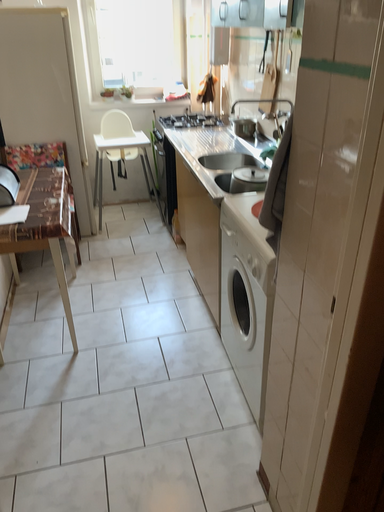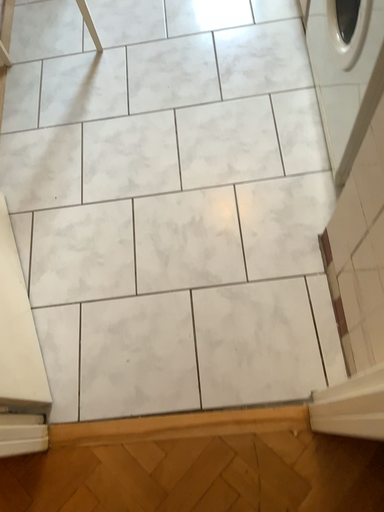
Question: Which way did the camera rotate in the video?

Choices:
 (A) rotated left
 (B) rotated right

Answer: (A)